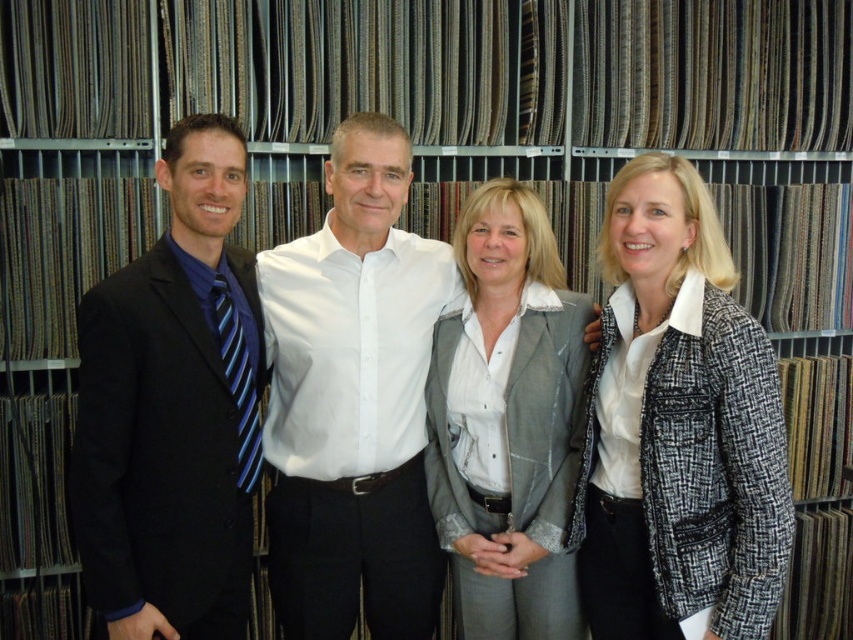
Based on the photo, is black tweed blazer at center above matte black suit at left?

Actually, black tweed blazer at center is below matte black suit at left.

Which is more to the left, black tweed blazer at center or matte black suit at left?

Positioned to the left is matte black suit at left.

The width and height of the screenshot is (853, 640). Describe the element at coordinates (677, 428) in the screenshot. I see `black tweed blazer at center` at that location.

This screenshot has height=640, width=853. I want to click on black tweed blazer at center, so click(677, 428).

The height and width of the screenshot is (640, 853). What do you see at coordinates (677, 428) in the screenshot?
I see `black tweed blazer at center` at bounding box center [677, 428].

Locate an element on the screen. The image size is (853, 640). black tweed blazer at center is located at coordinates (677, 428).

Where is `black tweed blazer at center`? This screenshot has width=853, height=640. black tweed blazer at center is located at coordinates (677, 428).

Between matte black suit at left and blue striped tie at left, which one is positioned higher?

blue striped tie at left

Who is more distant from viewer, (x=128, y=436) or (x=239, y=477)?

Positioned behind is point (x=239, y=477).

Locate an element on the screen. The width and height of the screenshot is (853, 640). matte black suit at left is located at coordinates (173, 410).